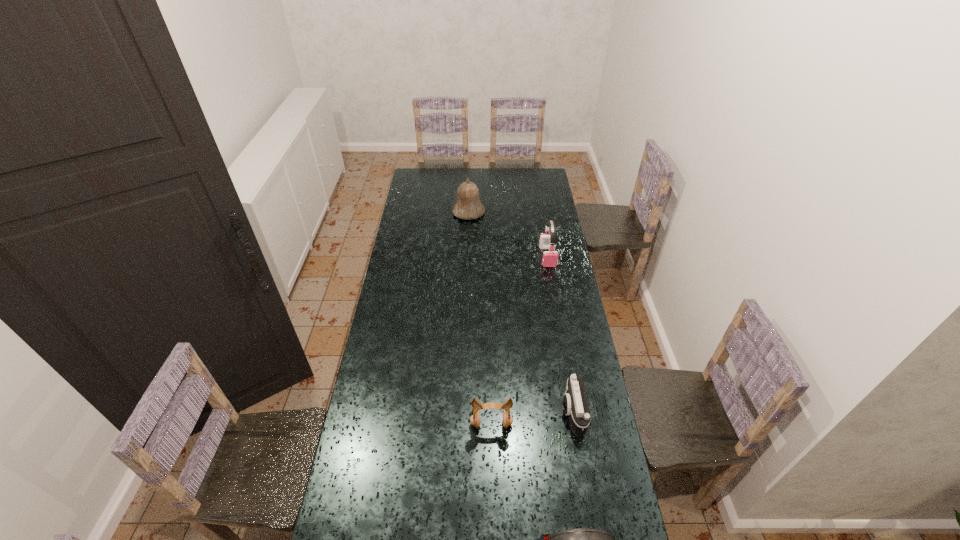
At what (x,y) coordinates should I click in order to perform the action: click on earphone present at the right edge. Please return your answer as a coordinate pair (x, y). This screenshot has height=540, width=960. Looking at the image, I should click on (550, 258).

The width and height of the screenshot is (960, 540). Find the location of `camera situated at the right edge`. camera situated at the right edge is located at coordinates (575, 403).

You are a GUI agent. You are given a task and a screenshot of the screen. Output one action in this format:
    pyautogui.click(x=<x>, y=<y>)
    Task: Click on the vacant space at the far edge
    The height and width of the screenshot is (540, 960).
    Given the screenshot: What is the action you would take?
    pyautogui.click(x=444, y=172)

The image size is (960, 540). In order to click on vacant region at the left edge of the desktop in this screenshot , I will do `click(408, 278)`.

Find the location of a particular element. Image resolution: width=960 pixels, height=540 pixels. vacant position at the right edge of the desktop is located at coordinates (556, 384).

The image size is (960, 540). I want to click on vacant space at the far left corner, so click(425, 187).

The height and width of the screenshot is (540, 960). What are the coordinates of `free space at the far right corner of the desktop` in the screenshot? It's located at point(547,187).

Where is `free space between the second nearest earphone and the shortest object`? free space between the second nearest earphone and the shortest object is located at coordinates (532, 418).

In order to click on vacant region between the farthest object and the fourth nearest object in this screenshot , I will do `click(508, 234)`.

In order to click on free space between the farthest earphone and the shortest object in this screenshot , I will do `click(560, 335)`.